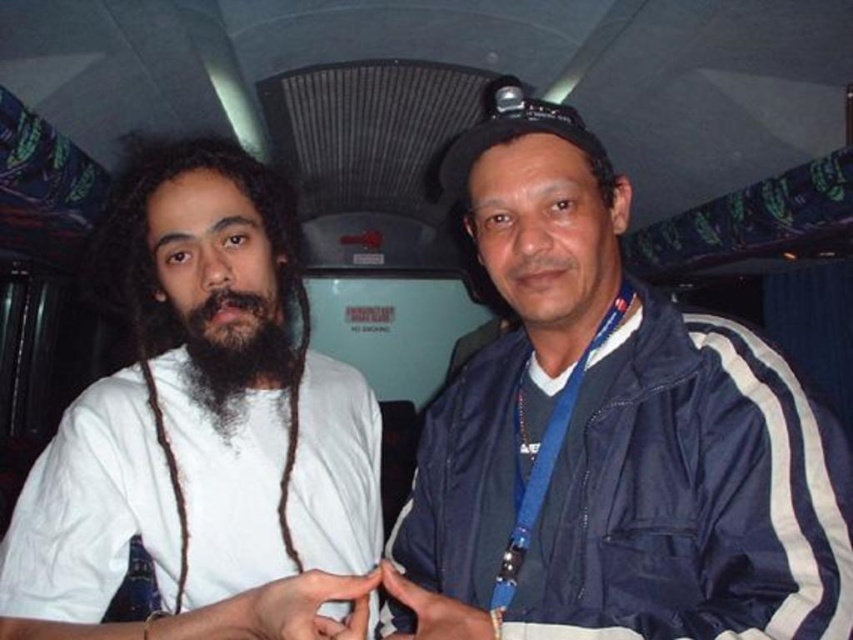
Can you confirm if white matte shirt at left is taller than black fuzzy beard at center?

Yes, white matte shirt at left is taller than black fuzzy beard at center.

Identify the location of white matte shirt at left. The image size is (853, 640). point(204,433).

At what (x,y) coordinates should I click in order to perform the action: click on white matte shirt at left. Please return your answer as a coordinate pair (x, y). Looking at the image, I should click on click(204, 433).

Can you confirm if blue fabric jacket at right is positioned below white matte shirt at left?

No.

Who is more forward, (757,403) or (274,413)?

Point (757,403) is in front.

Is point (488, 445) in front of point (230, 570)?

No, it is behind (230, 570).

The image size is (853, 640). Find the location of `blue fabric jacket at right`. blue fabric jacket at right is located at coordinates (612, 435).

Which of these two, blue fabric jacket at right or black fuzzy beard at center, stands taller?

blue fabric jacket at right

Does blue fabric jacket at right appear on the right side of black fuzzy beard at center?

Correct, you'll find blue fabric jacket at right to the right of black fuzzy beard at center.

Is point (439, 460) behind point (196, 374)?

Yes, it is.

Identify the location of blue fabric jacket at right. This screenshot has height=640, width=853. (612, 435).